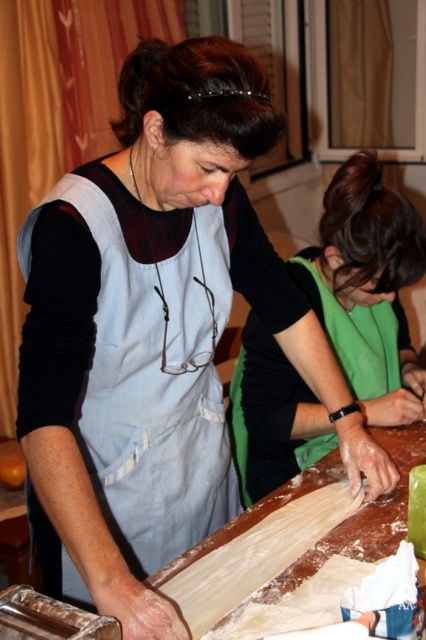
Question: Which point is farther from the camera taking this photo?

Choices:
 (A) (400, 256)
 (B) (213, 492)

Answer: (A)

Question: Does light blue fabric apron at center appear on the left side of green fabric apron at center?

Choices:
 (A) yes
 (B) no

Answer: (A)

Question: Does light blue fabric apron at center have a larger size compared to green fabric apron at center?

Choices:
 (A) no
 (B) yes

Answer: (B)

Question: Which object is closer to the camera taking this photo?

Choices:
 (A) light blue fabric apron at center
 (B) green fabric apron at center

Answer: (A)

Question: Among these points, which one is farthest from the camera?

Choices:
 (A) (419, 401)
 (B) (123, 381)

Answer: (A)

Question: Can you confirm if light blue fabric apron at center is positioned above green fabric apron at center?

Choices:
 (A) no
 (B) yes

Answer: (A)